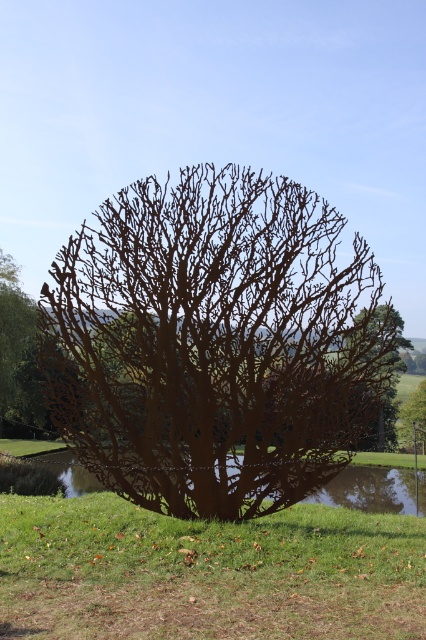
You are a landscape architect designing a garden and want to place a new bench between the rusty metal tree at center and the rustic wood tree at center. The bench requires a minimum of 50 feet of space between the two trees to fit comfortably. Can you place the bench between them?

The rusty metal tree at center and rustic wood tree at center are 54.97 feet apart, which is more than the required 50 feet, so yes, the bench can be placed between them comfortably.

Looking at this image, you are standing in front of the metal tree sculpture and notice two points on its branches. One is at coordinate point (348, 332) and the other at point (423, 400). Which of these points is closer to you?

Point (348, 332) is closer to the viewer than point (423, 400).

You are an artist planning to paint a landscape that includes both the rusty metal tree at center and the rustic wood tree at center. Which tree should you paint wider to accurately represent their sizes as seen in the image?

The rustic wood tree at center should be painted wider because the rusty metal tree at center has a lesser width compared to it.